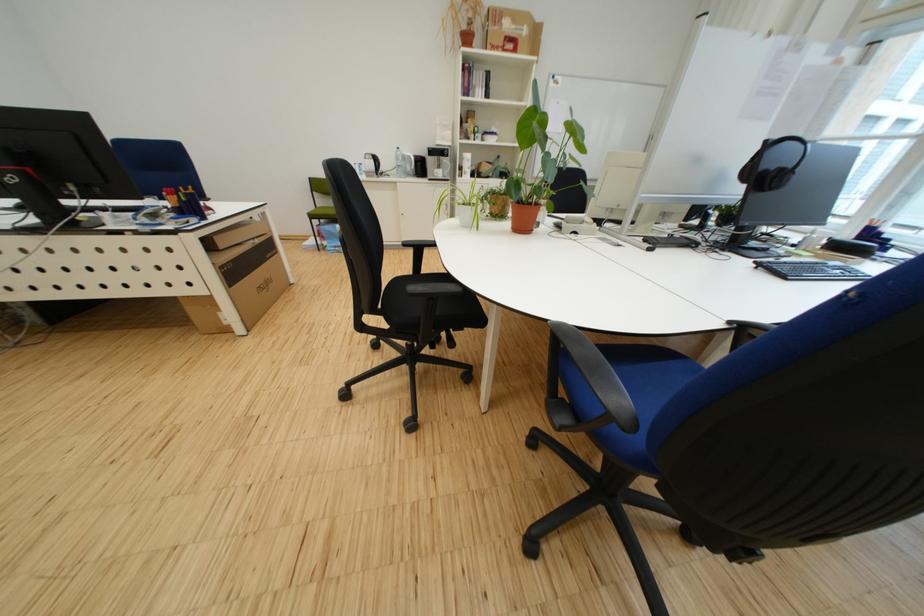
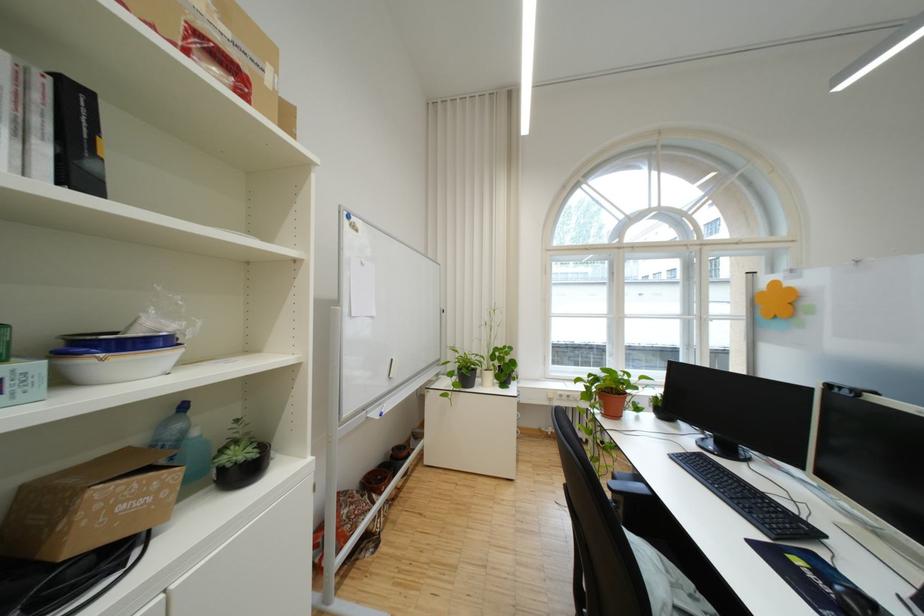
The point at (500,77) is marked in the first image. Where is the corresponding point in the second image?

(88, 100)